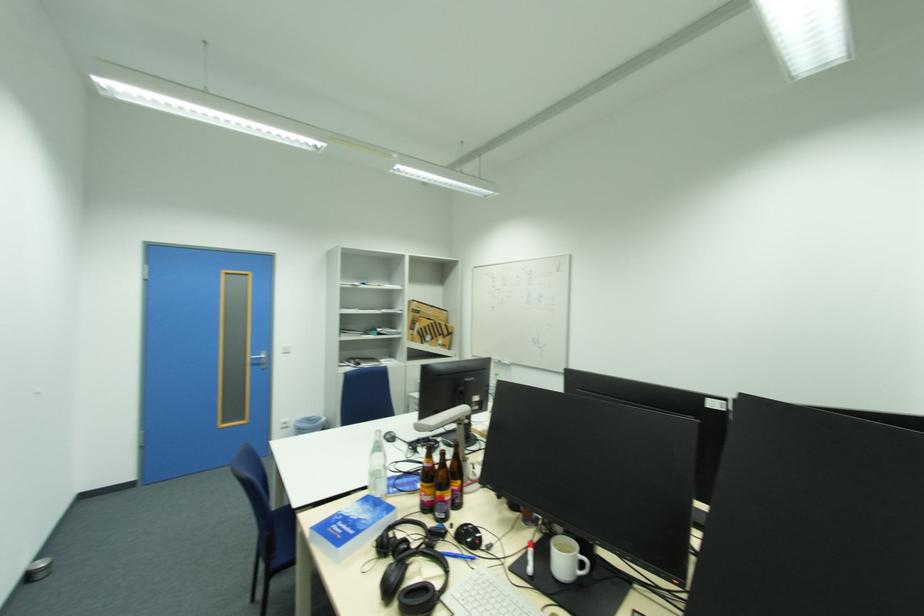
This screenshot has height=616, width=924. What do you see at coordinates (285, 349) in the screenshot?
I see `the white light switch` at bounding box center [285, 349].